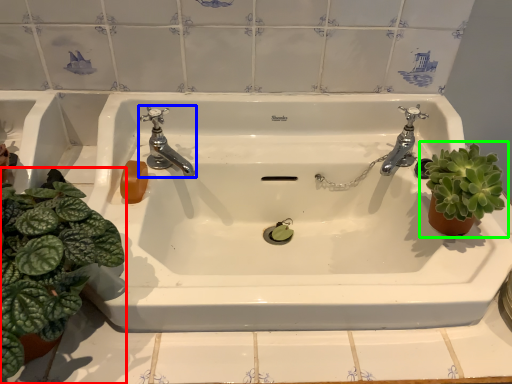
Question: Which object is the closest to the houseplant (highlighted by a red box)? Choose among these: tap (highlighted by a blue box) or houseplant (highlighted by a green box).

Choices:
 (A) tap
 (B) houseplant

Answer: (A)